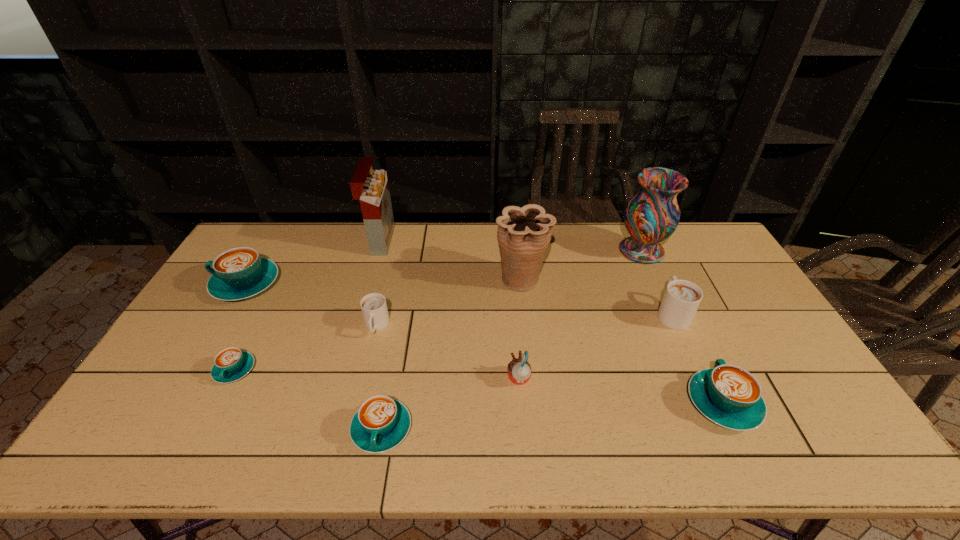
The width and height of the screenshot is (960, 540). Identify the location of free point between the rightmost turquoise cappuccino and the third tallest object. [x=622, y=341].

At what (x,y) coordinates should I click in order to perform the action: click on free spot between the bigger white cappuccino and the biggest turquoise cappuccino. Please return your answer as a coordinate pair (x, y). This screenshot has height=540, width=960. Looking at the image, I should click on (459, 299).

Locate an element on the screen. Image resolution: width=960 pixels, height=540 pixels. free space between the cigarette case and the pink muffin is located at coordinates (449, 309).

Find the location of a particular element. The image size is (960, 540). object that is the closest to the vase is located at coordinates [682, 298].

This screenshot has width=960, height=540. What are the coordinates of `the seventh closest object relative to the smaller white cappuccino` in the screenshot? It's located at (652, 215).

Choose which cappuccino is the nearest neighbor to the eighth shortest object. Please provide its 2D coordinates. Your answer should be formatted as a tuple, i.e. [(x, y)], where the tuple contains the x and y coordinates of a point satisfying the conditions above.

[(682, 298)]

Locate which cappuccino is the second closest to the cigarette case. Please provide its 2D coordinates. Your answer should be formatted as a tuple, i.e. [(x, y)], where the tuple contains the x and y coordinates of a point satisfying the conditions above.

[(374, 309)]

Point out which turquoise cappuccino is positioned as the fourth nearest to the right white cappuccino. Please provide its 2D coordinates. Your answer should be formatted as a tuple, i.e. [(x, y)], where the tuple contains the x and y coordinates of a point satisfying the conditions above.

[(239, 273)]

Point out which turquoise cappuccino is positioned as the second nearest to the red cigarette case. Please provide its 2D coordinates. Your answer should be formatted as a tuple, i.e. [(x, y)], where the tuple contains the x and y coordinates of a point satisfying the conditions above.

[(231, 364)]

The height and width of the screenshot is (540, 960). What are the coordinates of `vacant region that satisfies the following two spatial constraints: 1. with the handle on the right side of the rightmost turquoise cappuccino; 2. with the lid open on the red cigarette case` in the screenshot? It's located at (646, 241).